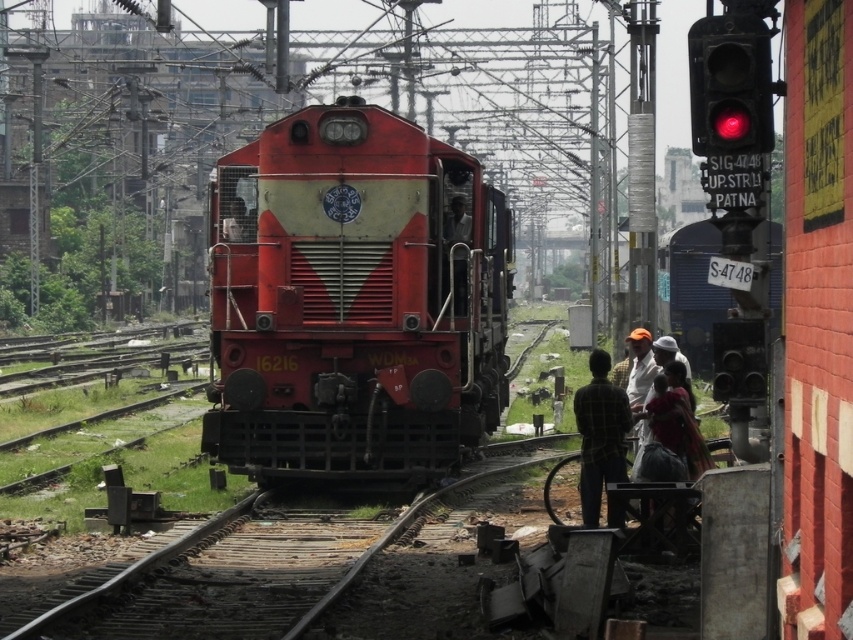
Question: Does plaid fabric shirt at center have a lesser width compared to matte black face at center?

Choices:
 (A) no
 (B) yes

Answer: (A)

Question: Does matte red locomotive at center appear under red glass traffic light at upper right?

Choices:
 (A) yes
 (B) no

Answer: (A)

Question: Is matte red locomotive at center to the left of red glass traffic light at upper right from the viewer's perspective?

Choices:
 (A) no
 (B) yes

Answer: (B)

Question: Which point is farther to the camera?

Choices:
 (A) plaid fabric shirt at center
 (B) matte red locomotive at center

Answer: (B)

Question: Estimate the real-world distances between objects in this image. Which object is closer to the matte black face at center?

Choices:
 (A) plaid fabric shirt at center
 (B) red glass traffic light at upper right
 (C) matte red locomotive at center

Answer: (C)

Question: Which object is the farthest from the matte black face at center?

Choices:
 (A) matte red locomotive at center
 (B) red glass traffic light at upper right
 (C) plaid fabric shirt at center

Answer: (C)